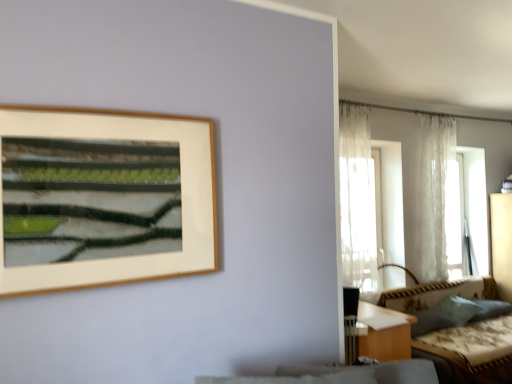
Question: Considering the relative sizes of sheer white curtain at right, placed as the second curtain when sorted from right to left, and translucent fabric window at right in the image provided, is sheer white curtain at right, placed as the second curtain when sorted from right to left, thinner than translucent fabric window at right?

Choices:
 (A) no
 (B) yes

Answer: (B)

Question: Is sheer white curtain at right, which is counted as the first curtain, starting from the front, next to translucent fabric window at right?

Choices:
 (A) no
 (B) yes

Answer: (A)

Question: From a real-world perspective, is sheer white curtain at right, which is the first curtain in left-to-right order, beneath translucent fabric window at right?

Choices:
 (A) yes
 (B) no

Answer: (B)

Question: Is sheer white curtain at right, which is counted as the first curtain, starting from the front, closer to the viewer compared to translucent fabric window at right?

Choices:
 (A) yes
 (B) no

Answer: (A)

Question: Is sheer white curtain at right, which ranks as the second curtain in back-to-front order, to the left of translucent fabric window at right from the viewer's perspective?

Choices:
 (A) yes
 (B) no

Answer: (A)

Question: Considering the relative sizes of sheer white curtain at right, placed as the second curtain when sorted from right to left, and translucent fabric window at right in the image provided, is sheer white curtain at right, placed as the second curtain when sorted from right to left, shorter than translucent fabric window at right?

Choices:
 (A) yes
 (B) no

Answer: (B)

Question: Is white sheer curtain at upper right, the 1th curtain in the back-to-front sequence, facing away from sheer white curtain at right, which is the first curtain in left-to-right order?

Choices:
 (A) yes
 (B) no

Answer: (B)

Question: Is white sheer curtain at upper right, the second curtain when ordered from left to right, completely or partially outside of sheer white curtain at right, placed as the second curtain when sorted from right to left?

Choices:
 (A) no
 (B) yes

Answer: (B)

Question: Would you consider white sheer curtain at upper right, the 1th curtain in the back-to-front sequence, to be distant from sheer white curtain at right, placed as the second curtain when sorted from right to left?

Choices:
 (A) yes
 (B) no

Answer: (B)

Question: Does white sheer curtain at upper right, which is the second curtain in front-to-back order, appear on the left side of sheer white curtain at right, which ranks as the second curtain in back-to-front order?

Choices:
 (A) yes
 (B) no

Answer: (B)

Question: Is white sheer curtain at upper right, the 1th curtain positioned from the right, at the right side of sheer white curtain at right, which is the first curtain in left-to-right order?

Choices:
 (A) no
 (B) yes

Answer: (B)

Question: From the image's perspective, is white sheer curtain at upper right, which is the second curtain in front-to-back order, on top of sheer white curtain at right, placed as the second curtain when sorted from right to left?

Choices:
 (A) no
 (B) yes

Answer: (B)

Question: Is white sheer curtain at upper right, which is the second curtain in front-to-back order, smaller than translucent fabric window at right?

Choices:
 (A) yes
 (B) no

Answer: (A)